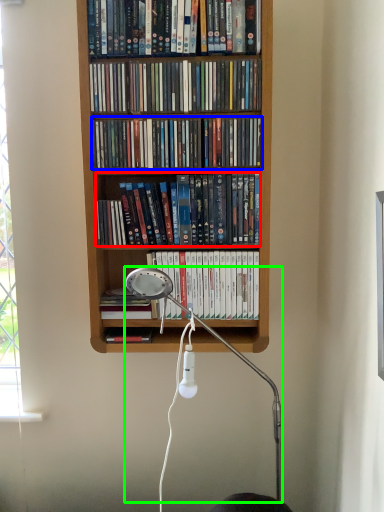
Question: Based on their relative distances, which object is nearer to book (highlighted by a red box)? Choose from book (highlighted by a blue box) and lamp (highlighted by a green box).

Choices:
 (A) book
 (B) lamp

Answer: (A)